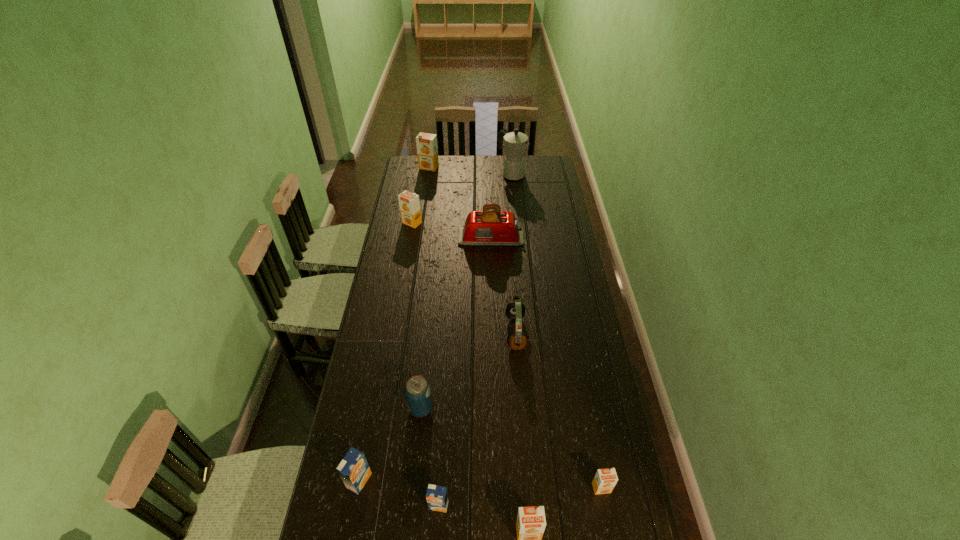
The height and width of the screenshot is (540, 960). What are the coordinates of `coffeepot` in the screenshot? It's located at (516, 143).

Locate an element on the screen. The width and height of the screenshot is (960, 540). gray coffeepot is located at coordinates (516, 143).

What are the coordinates of `the biggest orange orange juice` in the screenshot? It's located at (427, 150).

I want to click on the farthest orange orange juice, so click(427, 150).

You are a GUI agent. You are given a task and a screenshot of the screen. Output one action in this format:
    pyautogui.click(x=<x>, y=<y>)
    Task: Click on the red toaster
    Image resolution: width=960 pixels, height=540 pixels.
    Given the screenshot: What is the action you would take?
    pyautogui.click(x=491, y=227)

At what (x,y) coordinates should I click in order to perform the action: click on toaster. Please return your answer as a coordinate pair (x, y). This screenshot has height=540, width=960. Looking at the image, I should click on (491, 227).

Image resolution: width=960 pixels, height=540 pixels. I want to click on the second farthest orange_juice, so click(409, 203).

Where is `the third smallest orange orange juice`? the third smallest orange orange juice is located at coordinates (409, 203).

This screenshot has width=960, height=540. I want to click on the sixth nearest object, so click(x=515, y=310).

The image size is (960, 540). What are the coordinates of `the fifth nearest object` in the screenshot? It's located at (417, 390).